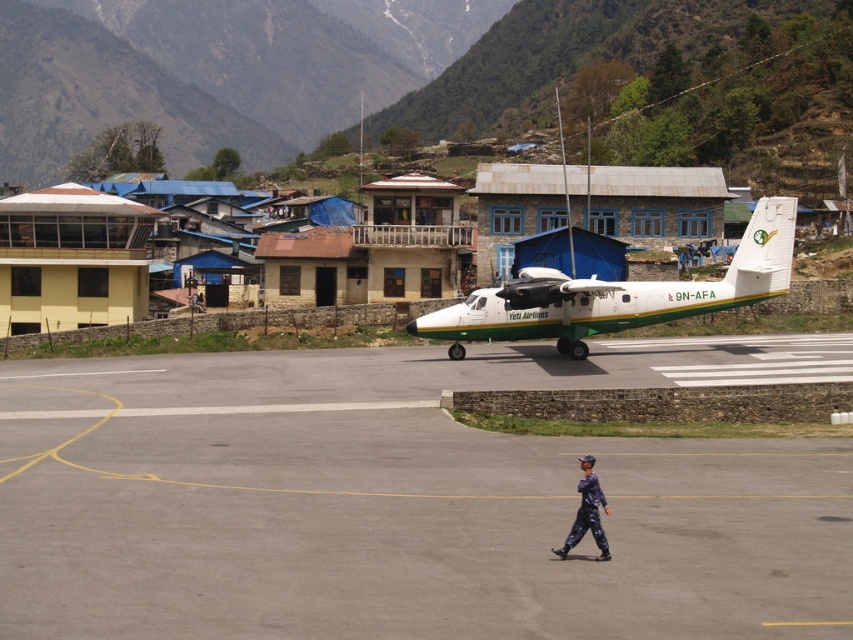
Question: Estimate the real-world distances between objects in this image. Which object is farther from the white matte airplane at center?

Choices:
 (A) purple fabric pants at center
 (B) gray asphalt tarmac at center

Answer: (A)

Question: Which point is closer to the camera?

Choices:
 (A) purple fabric pants at center
 (B) gray asphalt tarmac at center

Answer: (B)

Question: Is gray asphalt tarmac at center below purple fabric pants at center?

Choices:
 (A) no
 (B) yes

Answer: (B)

Question: Is white matte airplane at center above purple fabric pants at center?

Choices:
 (A) yes
 (B) no

Answer: (A)

Question: Which point is farther from the camera taking this photo?

Choices:
 (A) (476, 360)
 (B) (585, 484)
 (C) (532, 314)

Answer: (C)

Question: Does white matte airplane at center have a smaller size compared to purple fabric pants at center?

Choices:
 (A) no
 (B) yes

Answer: (A)